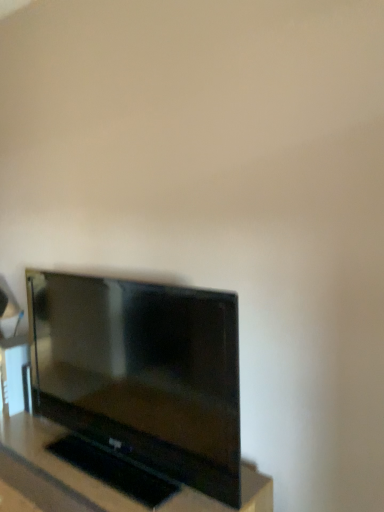
Question: Is black glossy tv at center turned away from matte black tv at lower left?

Choices:
 (A) no
 (B) yes

Answer: (A)

Question: Does black glossy tv at center have a lesser width compared to matte black tv at lower left?

Choices:
 (A) no
 (B) yes

Answer: (A)

Question: Can you confirm if black glossy tv at center is smaller than matte black tv at lower left?

Choices:
 (A) no
 (B) yes

Answer: (A)

Question: Can you confirm if black glossy tv at center is positioned to the right of matte black tv at lower left?

Choices:
 (A) no
 (B) yes

Answer: (A)

Question: Considering the relative sizes of black glossy tv at center and matte black tv at lower left in the image provided, is black glossy tv at center bigger than matte black tv at lower left?

Choices:
 (A) yes
 (B) no

Answer: (A)

Question: From the image's perspective, is black glossy tv at center above matte black tv at lower left?

Choices:
 (A) no
 (B) yes

Answer: (A)

Question: Is matte black tv at lower left thinner than black glossy tv at center?

Choices:
 (A) yes
 (B) no

Answer: (A)

Question: Is matte black tv at lower left smaller than black glossy tv at center?

Choices:
 (A) yes
 (B) no

Answer: (A)

Question: Can you confirm if matte black tv at lower left is taller than black glossy tv at center?

Choices:
 (A) no
 (B) yes

Answer: (A)

Question: Is matte black tv at lower left looking in the opposite direction of black glossy tv at center?

Choices:
 (A) yes
 (B) no

Answer: (B)

Question: Is matte black tv at lower left not within black glossy tv at center?

Choices:
 (A) yes
 (B) no

Answer: (A)

Question: Is matte black tv at lower left in front of black glossy tv at center?

Choices:
 (A) yes
 (B) no

Answer: (B)

Question: In terms of width, does matte black tv at lower left look wider or thinner when compared to black glossy tv at center?

Choices:
 (A) thin
 (B) wide

Answer: (A)